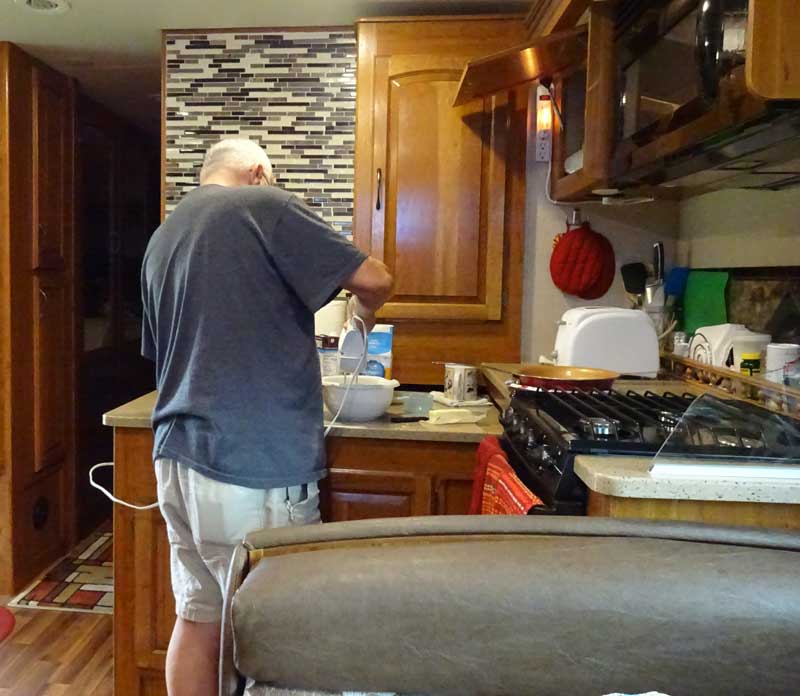
Locate an element on the screen. The width and height of the screenshot is (800, 696). floor tiling is located at coordinates (78, 582).